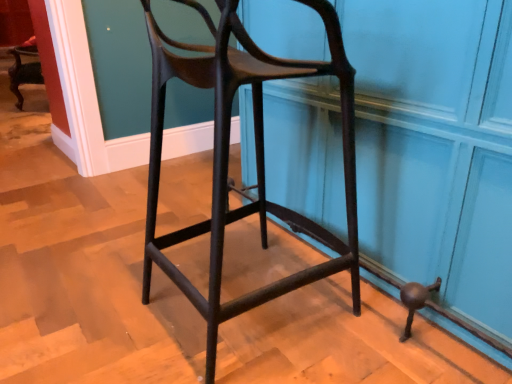
The image size is (512, 384). I want to click on vacant space situated on the left part of matte black stool at center, so [91, 302].